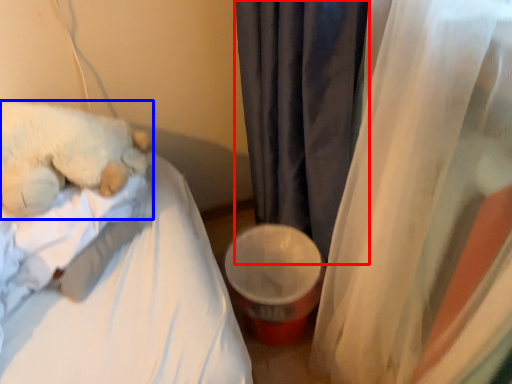
Question: Which object is further to the camera taking this photo, curtain (highlighted by a red box) or teddy bear (highlighted by a blue box)?

Choices:
 (A) curtain
 (B) teddy bear

Answer: (B)